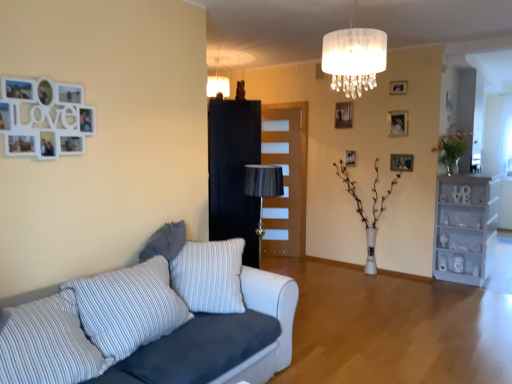
Question: Do you think wooden picture frame at center, which appears as the 2th picture frame when ordered from the bottom, is within white glossy vase at center, which is the second plant in top-to-bottom order, or outside of it?

Choices:
 (A) inside
 (B) outside

Answer: (A)

Question: In the image, is wooden picture frame at center, arranged as the fourth picture frame when viewed from the right, on the left side or the right side of white glossy vase at center, marked as the 1th plant in a left-to-right arrangement?

Choices:
 (A) right
 (B) left

Answer: (B)

Question: Which is farther from the wooden picture frame at upper center, acting as the third picture frame starting from the left?

Choices:
 (A) striped fabric pillow at lower left, arranged as the second pillow when viewed from the front
 (B) white glossy vase at center, the 2th plant positioned from the right
 (C) matte silver picture frame at upper center, which is the 2th picture frame in top-to-bottom order
 (D) striped fabric pillow at lower left, the first pillow from the front
 (E) wooden picture frame at center, which appears as the 2th picture frame when ordered from the bottom

Answer: (D)

Question: Estimate the real-world distances between objects in this image. Which object is farther from the wooden picture frame at upper right, marked as the 1th picture frame in a bottom-to-top arrangement?

Choices:
 (A) white fabric chandelier at upper center, arranged as the 2th lamp when viewed from the top
 (B) gray fabric pillow at left, the first pillow from the back
 (C) striped fabric pillow at lower left, arranged as the second pillow when viewed from the front
 (D) black glossy armoire at center
 (E) matte white lampshade at upper center, the 1th lamp positioned from the left

Answer: (C)